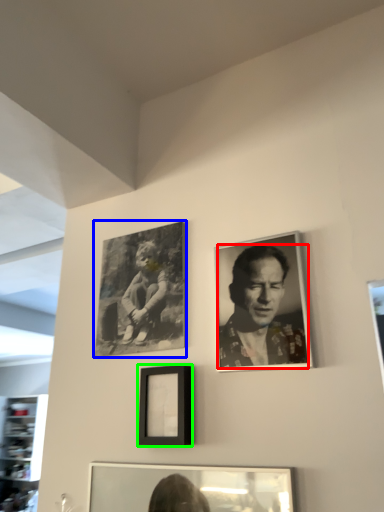
Question: Which object is positioned closest to man (highlighted by a red box)? Select from picture frame (highlighted by a blue box) and picture frame (highlighted by a green box).

Choices:
 (A) picture frame
 (B) picture frame

Answer: (B)